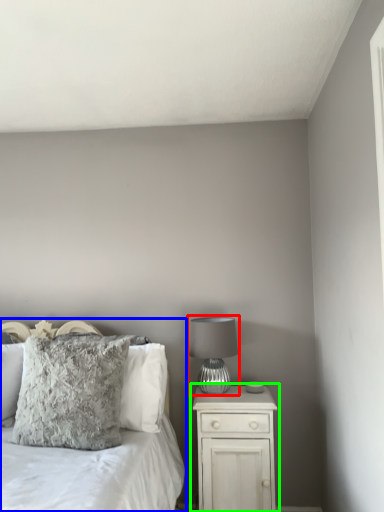
Question: Which object is the farthest from table lamp (highlighted by a red box)? Choose among these: bed (highlighted by a blue box) or nightstand (highlighted by a green box).

Choices:
 (A) bed
 (B) nightstand

Answer: (A)